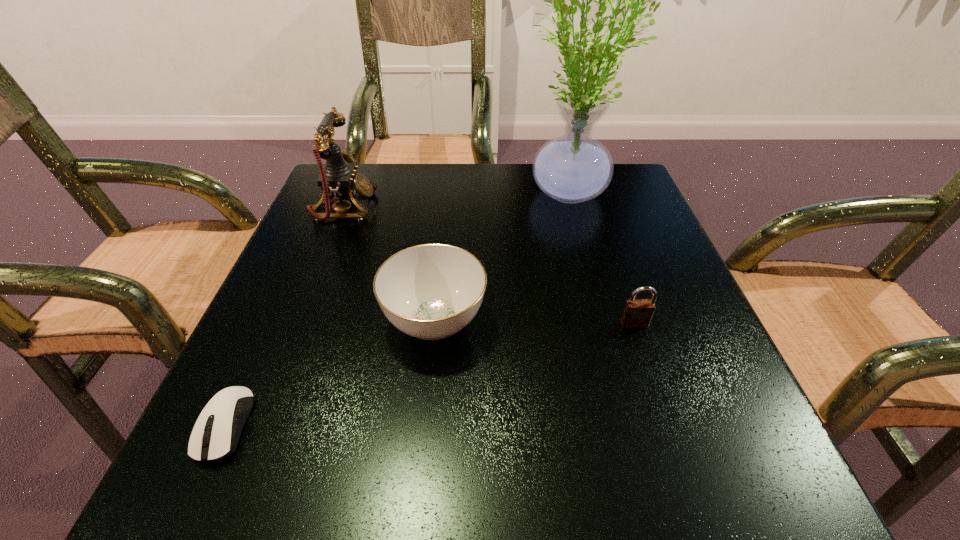
Where is `vacant space that is in between the tallest object and the telephone`? Image resolution: width=960 pixels, height=540 pixels. vacant space that is in between the tallest object and the telephone is located at coordinates (455, 201).

Locate an element on the screen. This screenshot has width=960, height=540. free space that is in between the third object from left to right and the mouse is located at coordinates (330, 373).

Image resolution: width=960 pixels, height=540 pixels. What are the coordinates of `free point between the telephone and the nearest object` in the screenshot? It's located at (285, 316).

The image size is (960, 540). What are the coordinates of `vacant space that is in between the shortest object and the telephone` in the screenshot? It's located at (285, 316).

I want to click on free spot between the flower arrangement and the fourth shortest object, so click(x=455, y=201).

This screenshot has width=960, height=540. Identify the location of unoccupied position between the flower arrangement and the chinaware. (500, 258).

In order to click on the closest object to the telephone in this screenshot , I will do `click(431, 291)`.

Identify which object is the third nearest to the fourth shortest object. Please provide its 2D coordinates. Your answer should be formatted as a tuple, i.e. [(x, y)], where the tuple contains the x and y coordinates of a point satisfying the conditions above.

[(218, 441)]

Locate an element on the screen. vacant point that satisfies the following two spatial constraints: 1. on the back side of the chinaware; 2. on the front of the telephone, featuring the rotary dial is located at coordinates (445, 208).

Where is `vacant space that satisfies the following two spatial constraints: 1. on the back side of the tallest object; 2. on the left side of the third object from left to right`? vacant space that satisfies the following two spatial constraints: 1. on the back side of the tallest object; 2. on the left side of the third object from left to right is located at coordinates (447, 194).